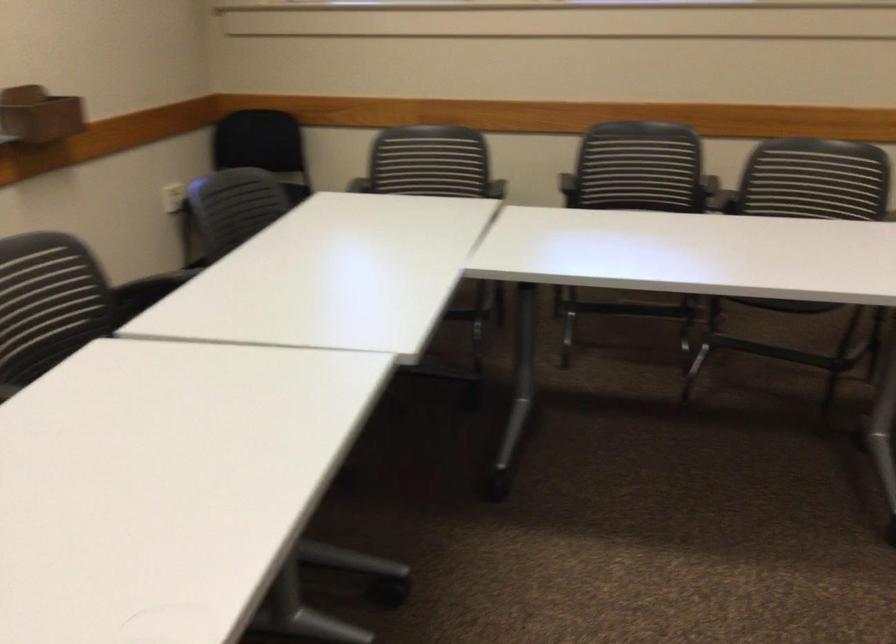
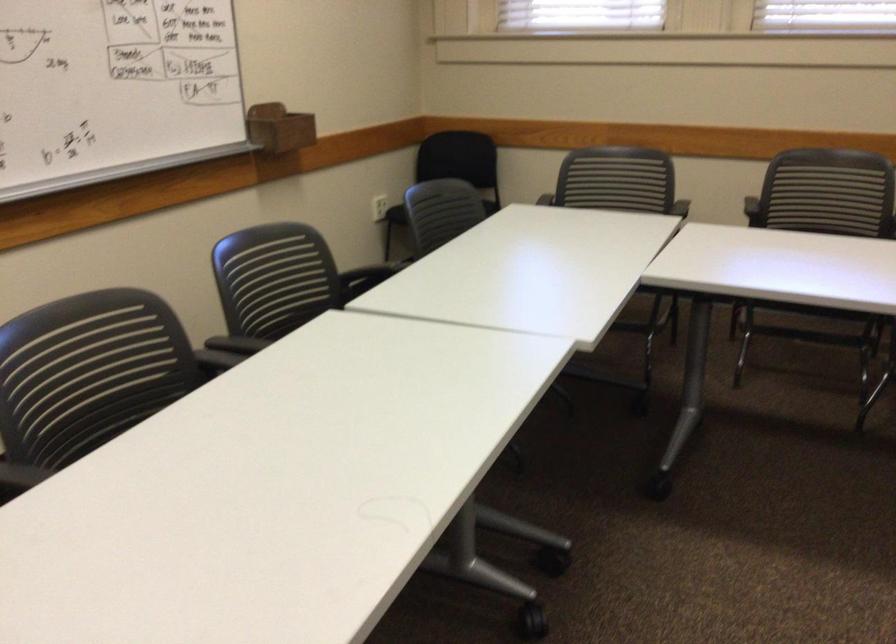
Find the pixel in the second image that matches the point at 642,182 in the first image.

(828, 200)